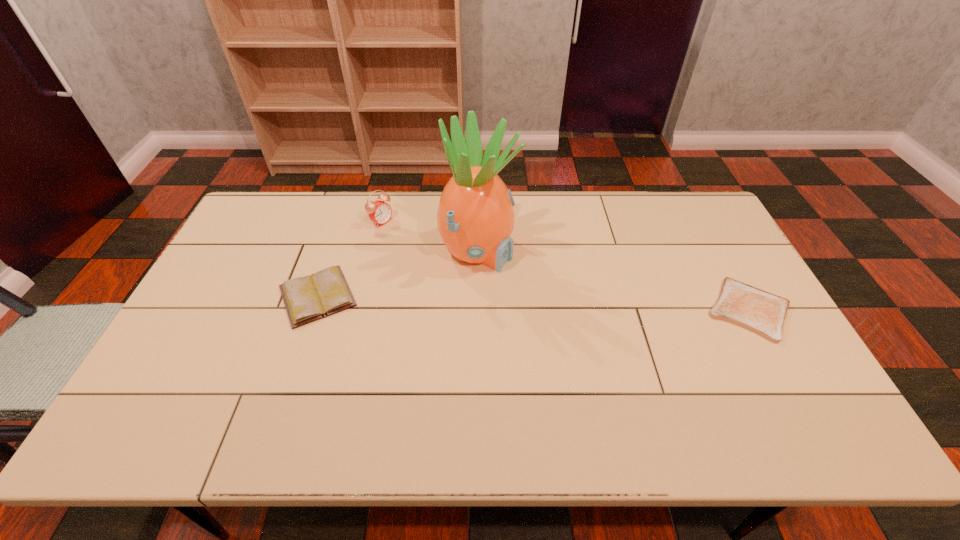
Find the location of a particular element. free space between the rightmost object and the second shortest object is located at coordinates (533, 303).

Where is `free space between the rightmost object and the pineapple`? The height and width of the screenshot is (540, 960). free space between the rightmost object and the pineapple is located at coordinates (613, 280).

Identify the location of the third closest object to the alarm clock. (761, 312).

Locate an element on the screen. The height and width of the screenshot is (540, 960). object identified as the second closest to the alarm clock is located at coordinates (326, 292).

Where is `free space that satisfies the following two spatial constraints: 1. on the front side of the diary; 2. on the right side of the rightmost object`? Image resolution: width=960 pixels, height=540 pixels. free space that satisfies the following two spatial constraints: 1. on the front side of the diary; 2. on the right side of the rightmost object is located at coordinates (313, 310).

Locate an element on the screen. free point that satisfies the following two spatial constraints: 1. on the front side of the pineapple; 2. on the left side of the rightmost object is located at coordinates (477, 310).

Identify the location of free space that satisfies the following two spatial constraints: 1. on the front side of the third object from left to right; 2. on the left side of the toast. [x=477, y=310].

Find the location of a particular element. This screenshot has height=540, width=960. vacant position in the image that satisfies the following two spatial constraints: 1. on the front side of the second shortest object; 2. on the right side of the rightmost object is located at coordinates (313, 310).

Locate an element on the screen. The height and width of the screenshot is (540, 960). blank space that satisfies the following two spatial constraints: 1. on the front side of the rightmost object; 2. on the right side of the tallest object is located at coordinates (477, 310).